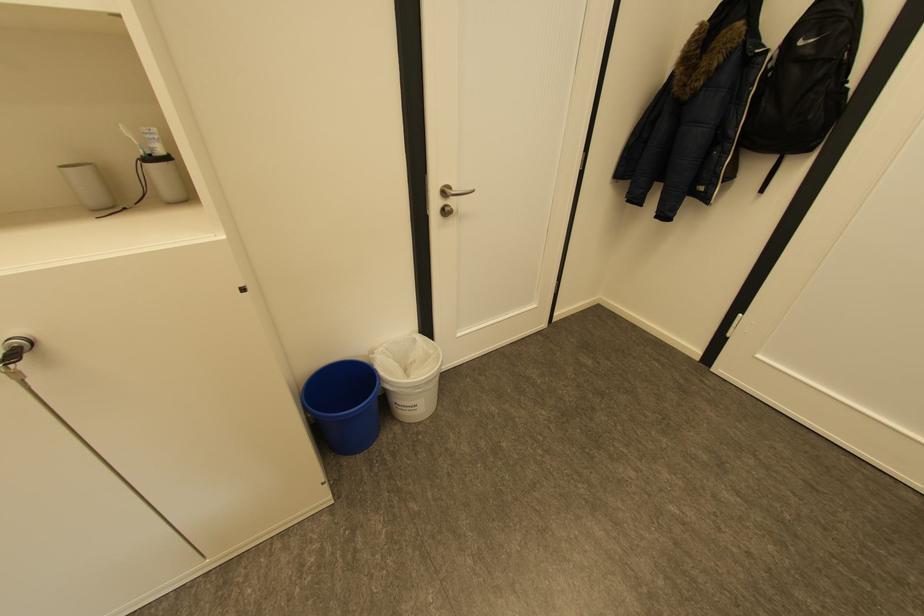
At what (x,y) coordinates should I click in order to perform the action: click on silver door handle. Please return your answer as a coordinate pair (x, y). Image resolution: width=924 pixels, height=616 pixels. Looking at the image, I should click on (x=451, y=198).